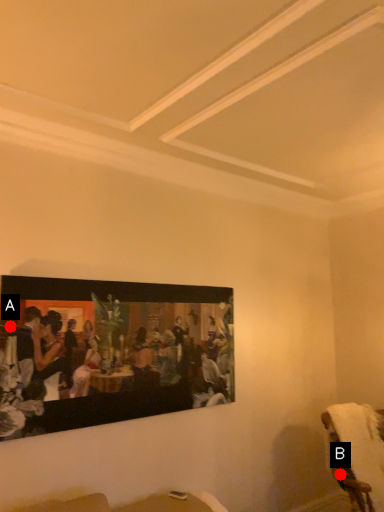
Question: Two points are circled on the image, labeled by A and B beside each circle. Which point is closer to the camera taking this photo?

Choices:
 (A) A is closer
 (B) B is closer

Answer: (A)